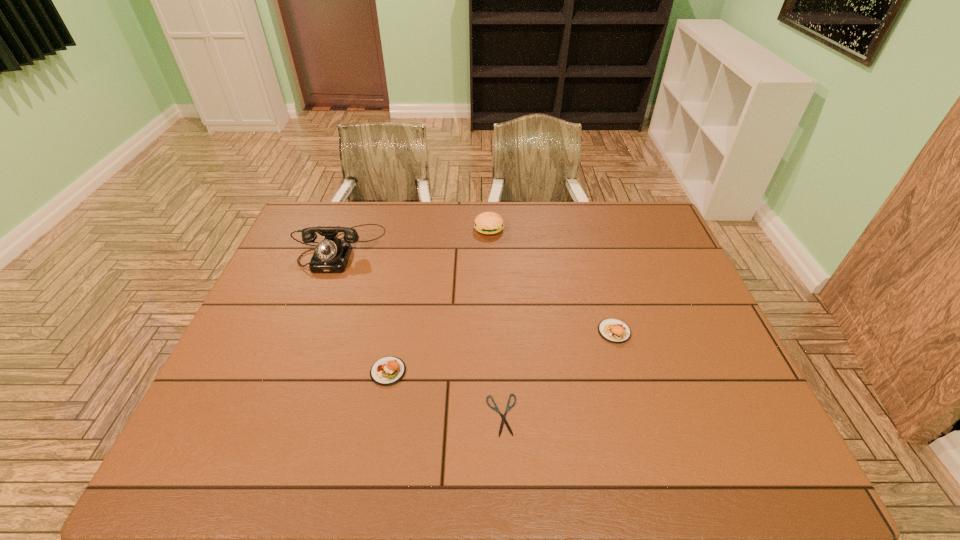
Image resolution: width=960 pixels, height=540 pixels. In order to click on blank area in the image that satisfies the following two spatial constraints: 1. on the front-facing side of the leftmost object; 2. on the right side of the nearest object in this screenshot , I will do point(277,415).

Where is `free space that satisfies the following two spatial constraints: 1. on the front-facing side of the leftmost object; 2. on the left side of the second shortest patty (food)`? free space that satisfies the following two spatial constraints: 1. on the front-facing side of the leftmost object; 2. on the left side of the second shortest patty (food) is located at coordinates (308, 332).